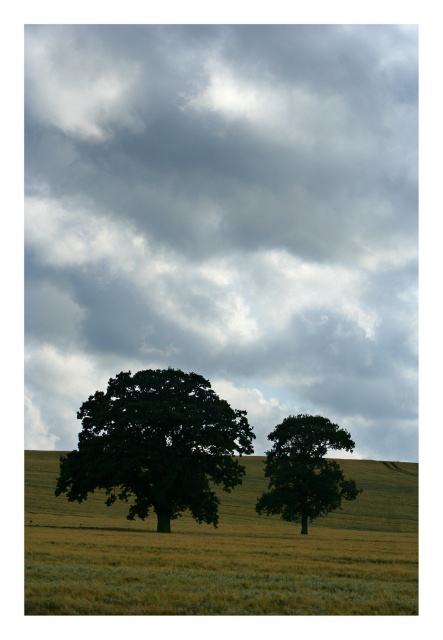
You are an artist planning to paint the scene. You want to ensure the cloudy gray sky at upper center and the green leafy oak at center are proportionate. Based on the scene, which object should you make larger in your painting?

The cloudy gray sky at upper center should be made larger than the green leafy oak at center in the painting since it is bigger in the scene.

You are a photographer planning to capture the two trees in the center of the image. Given that your camera has a fixed frame width of 3 meters, can you determine which tree, the green leafy oak at center or the green leafy tree at center, will occupy more space within the frame?

The green leafy oak at center has a greater width than the green leafy tree at center, so it will occupy more space within the 3 meter frame.